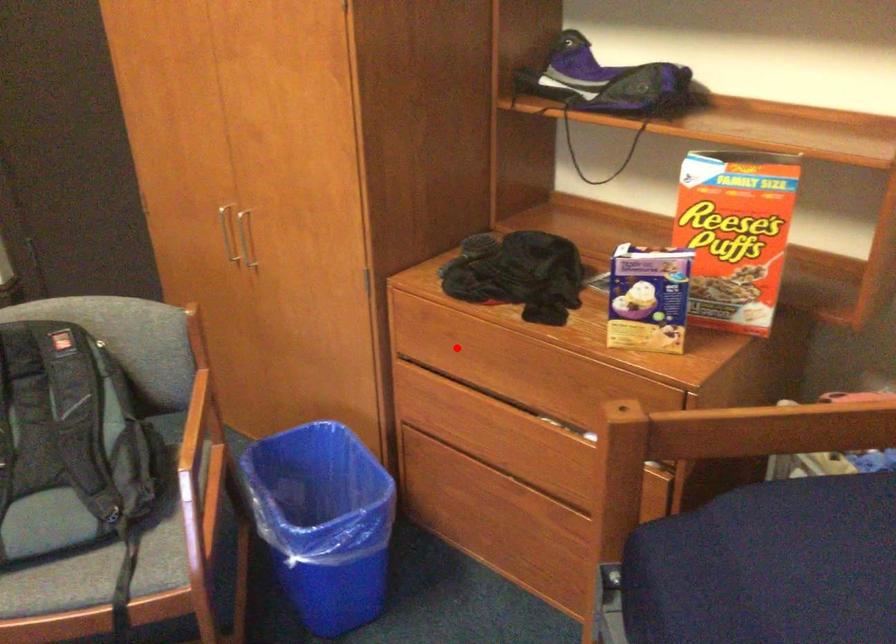
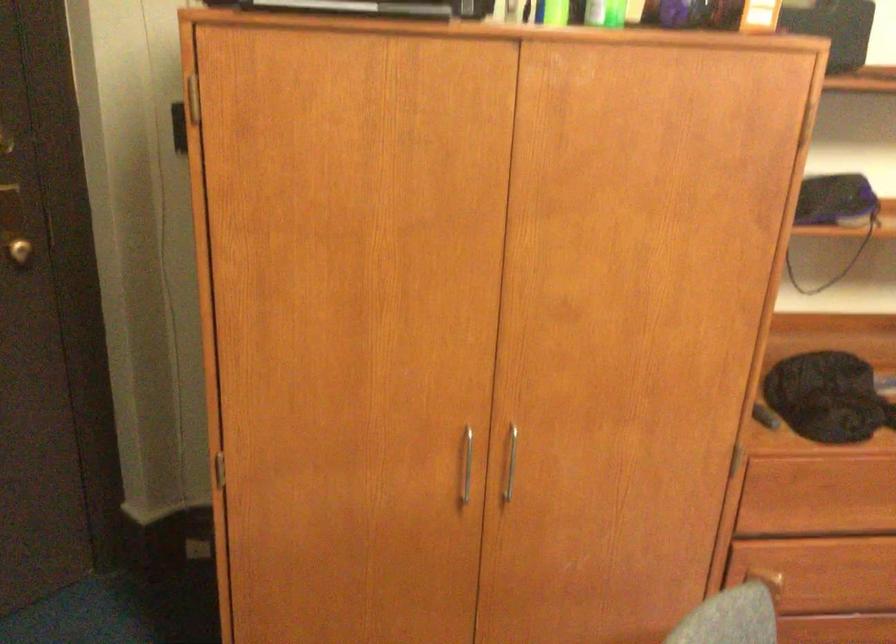
Question: I am providing you with two images of the same scene from different viewpoints. A red point is shown in image1. For the corresponding object point in image2, is it positioned nearer or farther from the camera?

Choices:
 (A) Nearer
 (B) Farther

Answer: (A)